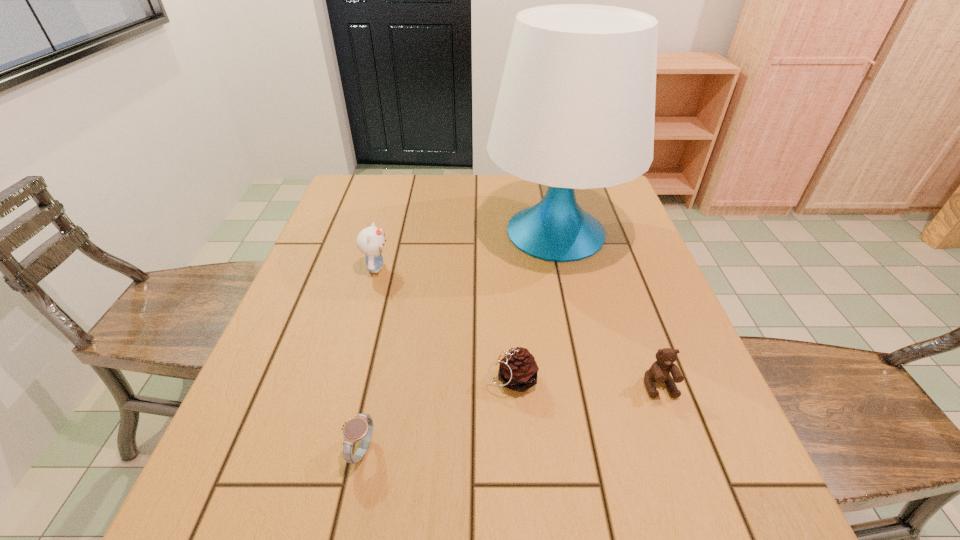
What are the coordinates of `free space at the left edge of the desktop` in the screenshot? It's located at (345, 277).

The width and height of the screenshot is (960, 540). I want to click on vacant space at the right edge of the desktop, so click(x=649, y=404).

Find the location of a particular element. This screenshot has height=540, width=960. free spot at the far left corner of the desktop is located at coordinates (383, 177).

The height and width of the screenshot is (540, 960). In the image, there is a desktop. Find the location of `vacant space at the near left corner`. vacant space at the near left corner is located at coordinates (267, 503).

This screenshot has width=960, height=540. Identify the location of vacant area that lies between the table lamp and the leftmost object. (467, 250).

This screenshot has width=960, height=540. I want to click on free space that is in between the teddy bear and the shortest object, so click(511, 418).

Where is `empty location between the kitten and the fourth object from right to left`? Image resolution: width=960 pixels, height=540 pixels. empty location between the kitten and the fourth object from right to left is located at coordinates (369, 359).

Identify the location of free space between the teddy bear and the tallest object. The image size is (960, 540). (608, 309).

At what (x,y) coordinates should I click in order to perform the action: click on free space between the leftmost object and the fourth object from right to left. Please return your answer as a coordinate pair (x, y). Image resolution: width=960 pixels, height=540 pixels. Looking at the image, I should click on (369, 359).

At what (x,y) coordinates should I click in order to perform the action: click on empty space between the pinecone and the teddy bear. Please return your answer as a coordinate pair (x, y). Looking at the image, I should click on (586, 382).